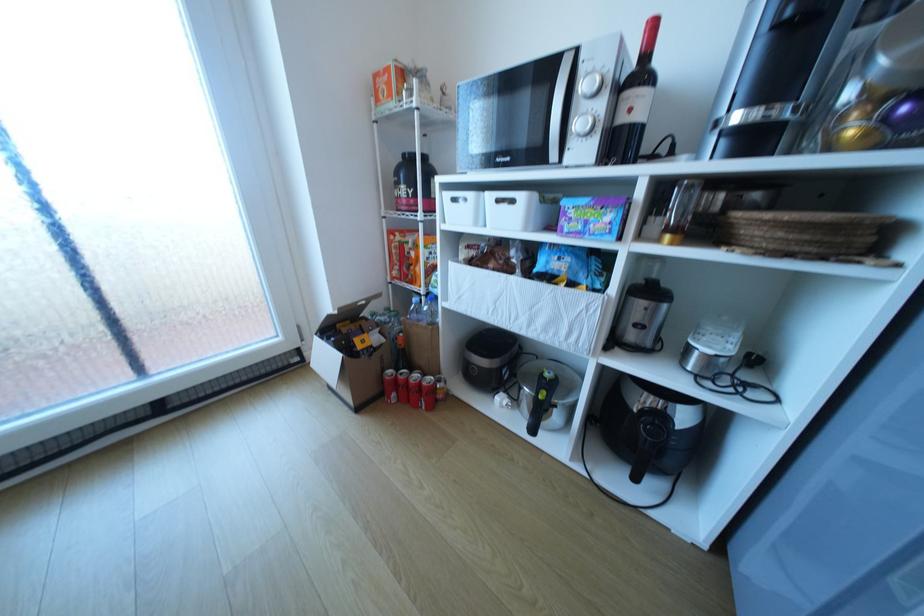
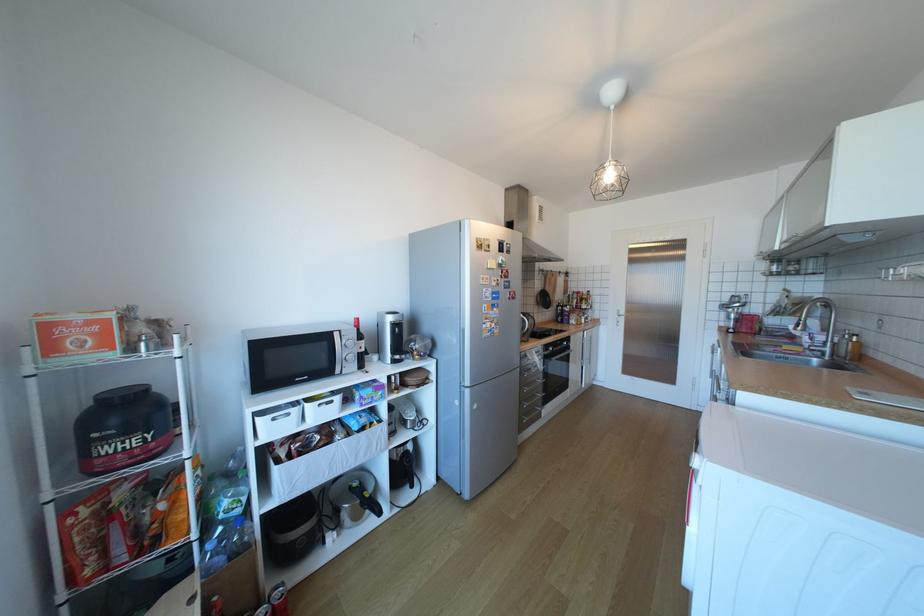
Where in the second image is the point corresponding to (x=542, y=394) from the first image?

(369, 501)